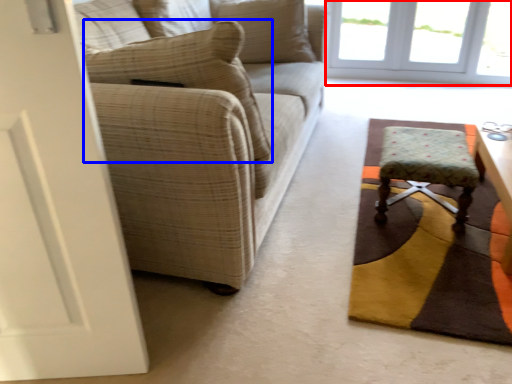
Question: Among these objects, which one is nearest to the camera, window (highlighted by a red box) or pillow (highlighted by a blue box)?

Choices:
 (A) window
 (B) pillow

Answer: (B)